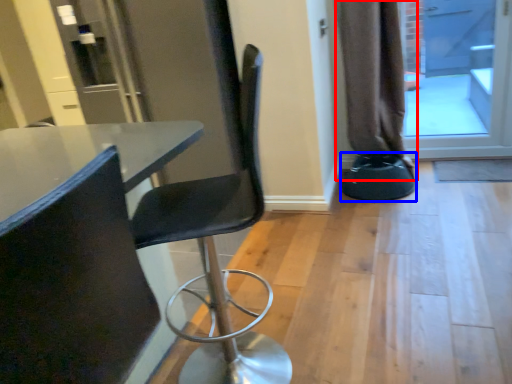
Question: Which object is further to the camera taking this photo, curtain (highlighted by a red box) or bar stool (highlighted by a blue box)?

Choices:
 (A) curtain
 (B) bar stool

Answer: (B)